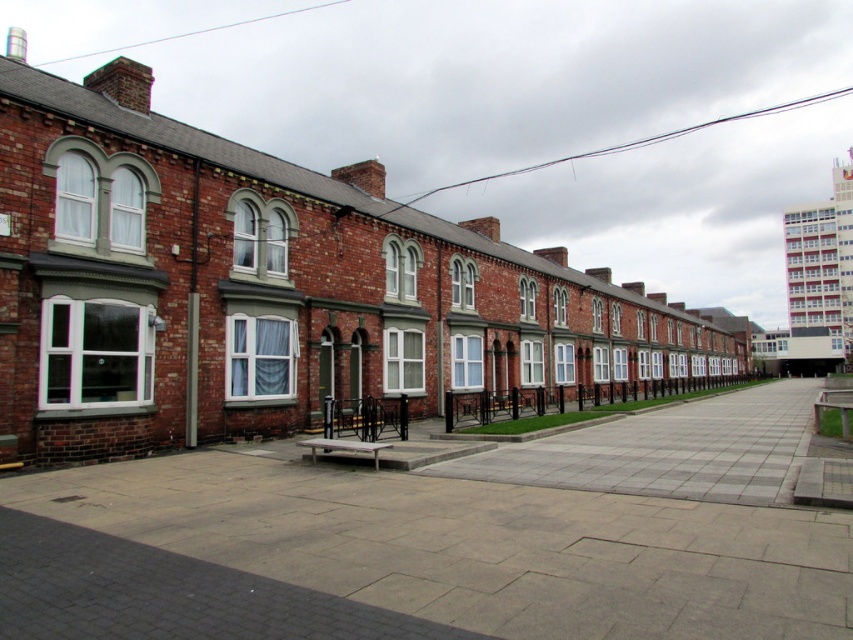
Is gray concrete pavement at center below brick wall at center?

Incorrect, gray concrete pavement at center is not positioned below brick wall at center.

Between point (778, 442) and point (512, 458), which one is positioned in front?

Point (512, 458) is more forward.

Find the location of `gray concrete pavement at center`. gray concrete pavement at center is located at coordinates (436, 544).